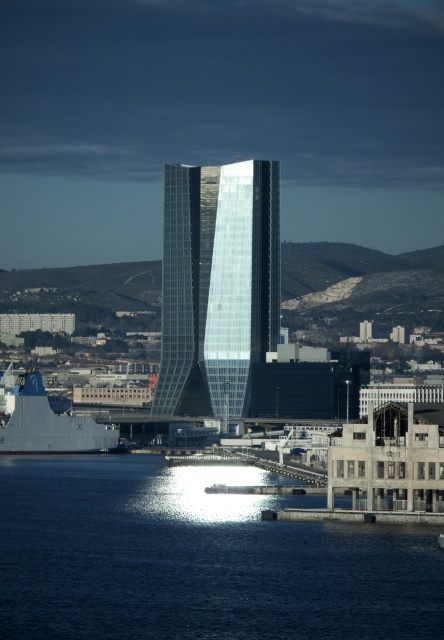
You are a photographer planning to capture the blue water at lower left and the glassy steel tower at center in a single shot. Based on their widths, which object should you prioritize positioning closer to the camera to ensure both fit in the frame?

The blue water at lower left might be wider than the glassy steel tower at center, so you should prioritize positioning the blue water at lower left closer to the camera to ensure both fit in the frame.

Looking at this image, you are standing at the edge of the water and want to take a photo of the gray metallic ship at lower left without the blue water at lower left appearing in the foreground. Is this possible?

The blue water at lower left is in front of the gray metallic ship at lower left, so it would block the view of the ship. Therefore, you cannot take a photo of the gray metallic ship at lower left without the blue water at lower left appearing in the foreground.